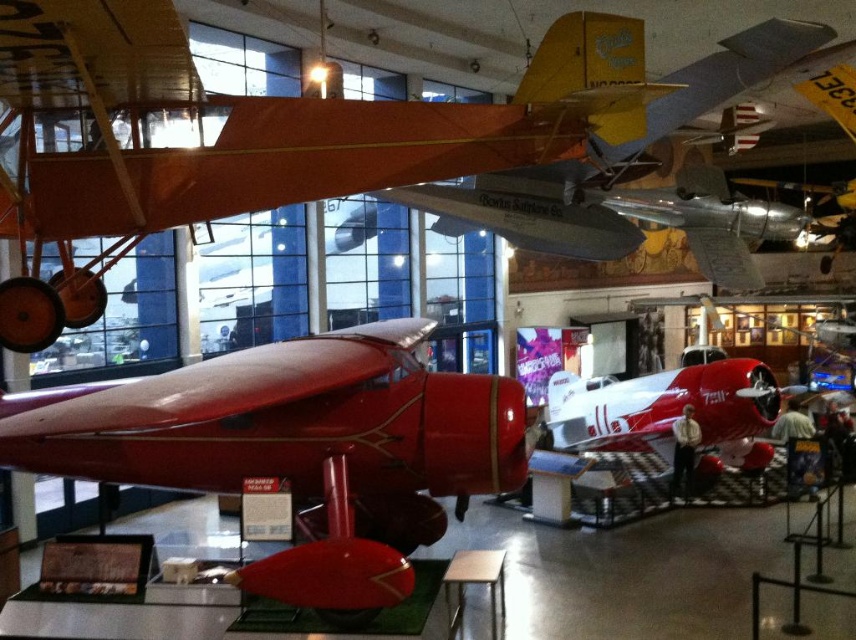
Question: Which of the following is the farthest from the observer?

Choices:
 (A) (116, 458)
 (B) (403, 170)
 (C) (758, 358)

Answer: (C)

Question: Does glossy red airplane at center appear over polished red airplane at center?

Choices:
 (A) no
 (B) yes

Answer: (B)

Question: Does glossy red airplane at center appear over matte red airplane at center?

Choices:
 (A) yes
 (B) no

Answer: (B)

Question: Which of these objects is positioned closest to the glossy red airplane at center?

Choices:
 (A) polished red airplane at center
 (B) matte red airplane at center

Answer: (B)

Question: Can you confirm if glossy red airplane at center is positioned above matte red airplane at center?

Choices:
 (A) yes
 (B) no

Answer: (B)

Question: Which point appears farthest from the camera in this image?

Choices:
 (A) (486, 132)
 (B) (290, 346)

Answer: (B)